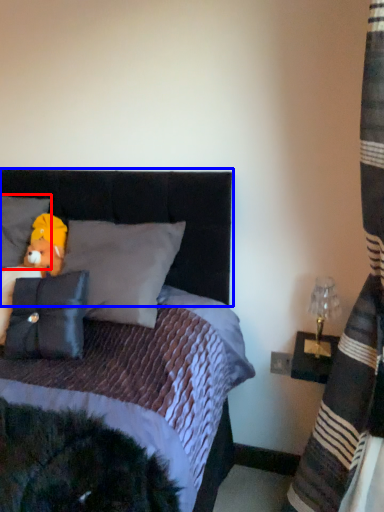
Question: Among these objects, which one is nearest to the camera, pillow (highlighted by a red box) or headboard (highlighted by a blue box)?

Choices:
 (A) pillow
 (B) headboard

Answer: (B)